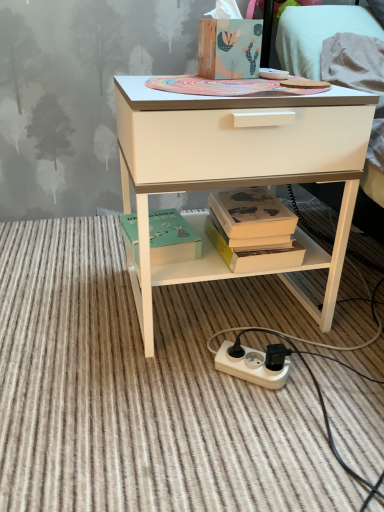
Find the location of a particular element. The height and width of the screenshot is (512, 384). empty space that is ontop of hardcover book at center (from a real-world perspective) is located at coordinates (254, 202).